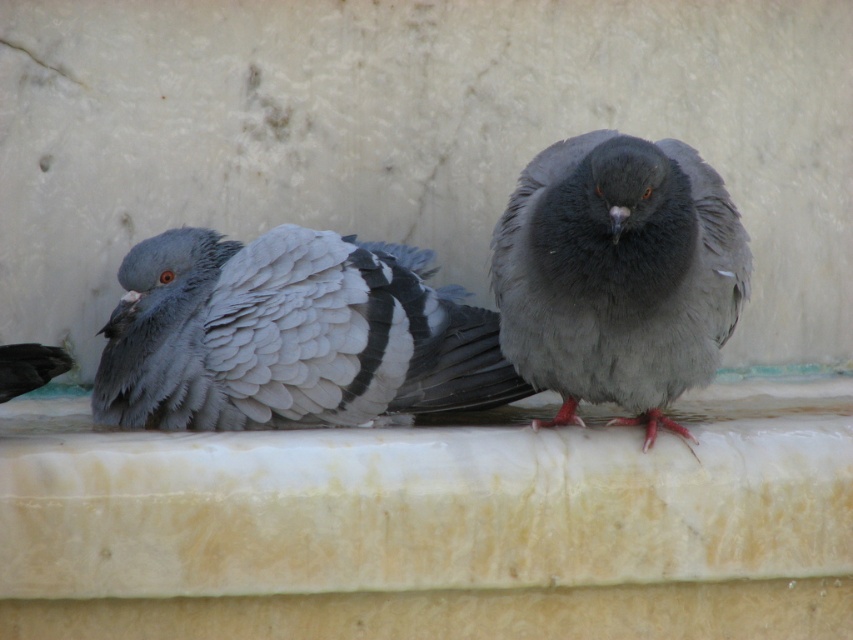
Question: Does gray matte feathers at center have a smaller size compared to gray matte pigeon at center?

Choices:
 (A) yes
 (B) no

Answer: (A)

Question: Which point is closer to the camera?

Choices:
 (A) (502, 234)
 (B) (384, 360)

Answer: (A)

Question: Among these points, which one is farthest from the camera?

Choices:
 (A) (287, 390)
 (B) (668, 368)

Answer: (A)

Question: Which object is closer to the camera taking this photo?

Choices:
 (A) gray matte pigeon at center
 (B) gray matte feathers at center

Answer: (A)

Question: Does gray matte feathers at center have a greater width compared to gray matte pigeon at center?

Choices:
 (A) yes
 (B) no

Answer: (A)

Question: Does gray matte feathers at center appear under gray matte pigeon at center?

Choices:
 (A) no
 (B) yes

Answer: (B)